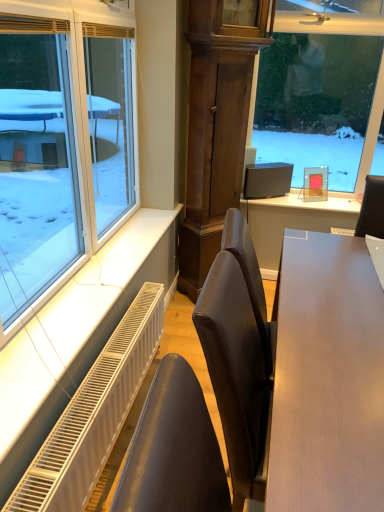
Question: From a real-world perspective, is light brown wooden table at center under satin black monitor at upper center?

Choices:
 (A) no
 (B) yes

Answer: (B)

Question: From the image's perspective, would you say light brown wooden table at center is positioned over satin black monitor at upper center?

Choices:
 (A) yes
 (B) no

Answer: (B)

Question: From a real-world perspective, is light brown wooden table at center on satin black monitor at upper center?

Choices:
 (A) yes
 (B) no

Answer: (B)

Question: Considering the relative positions of light brown wooden table at center and satin black monitor at upper center in the image provided, is light brown wooden table at center behind satin black monitor at upper center?

Choices:
 (A) yes
 (B) no

Answer: (B)

Question: Considering the relative sizes of light brown wooden table at center and satin black monitor at upper center in the image provided, is light brown wooden table at center smaller than satin black monitor at upper center?

Choices:
 (A) yes
 (B) no

Answer: (B)

Question: Is light brown wooden table at center closer to the viewer compared to satin black monitor at upper center?

Choices:
 (A) no
 (B) yes

Answer: (B)

Question: Does satin black monitor at upper center have a smaller size compared to clear glass window at left?

Choices:
 (A) yes
 (B) no

Answer: (A)

Question: Is satin black monitor at upper center further to the viewer compared to clear glass window at left?

Choices:
 (A) no
 (B) yes

Answer: (B)

Question: From a real-world perspective, is satin black monitor at upper center on clear glass window at left?

Choices:
 (A) yes
 (B) no

Answer: (B)

Question: Is satin black monitor at upper center looking in the opposite direction of clear glass window at left?

Choices:
 (A) yes
 (B) no

Answer: (B)

Question: Does satin black monitor at upper center appear on the right side of clear glass window at left?

Choices:
 (A) yes
 (B) no

Answer: (A)

Question: Is satin black monitor at upper center taller than clear glass window at left?

Choices:
 (A) no
 (B) yes

Answer: (A)

Question: Can you confirm if white metal radiator at lower left is positioned to the left of light brown wooden table at center?

Choices:
 (A) no
 (B) yes

Answer: (B)